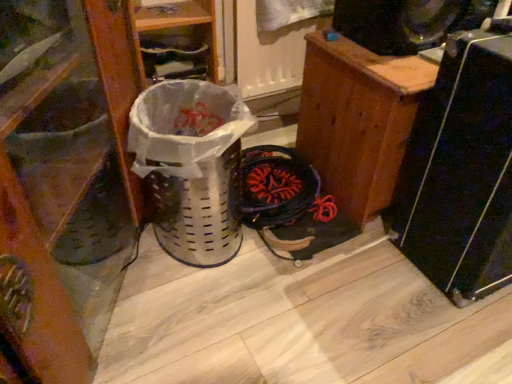
Question: In terms of width, does wooden shoe at left, arranged as the 1th furniture when viewed from the left, look wider or thinner when compared to white plastic basket at center?

Choices:
 (A) wide
 (B) thin

Answer: (A)

Question: In the image, is wooden shoe at left, arranged as the 1th furniture when viewed from the left, on the left side or the right side of white plastic basket at center?

Choices:
 (A) right
 (B) left

Answer: (B)

Question: Estimate the real-world distances between objects in this image. Which object is farther from the transparent plastic screen door at upper center?

Choices:
 (A) wooden cabinet at right, the first furniture when ordered from right to left
 (B) black plastic speaker at upper right
 (C) black plastic speaker at right
 (D) white plastic basket at center
 (E) wooden shoe at left, arranged as the 1th furniture when viewed from the left

Answer: (E)

Question: Which object is the closest to the black plastic speaker at right?

Choices:
 (A) black plastic speaker at upper right
 (B) white plastic basket at center
 (C) transparent plastic screen door at upper center
 (D) wooden cabinet at right, the first furniture when ordered from right to left
 (E) wooden shoe at left, acting as the second furniture starting from the right

Answer: (D)